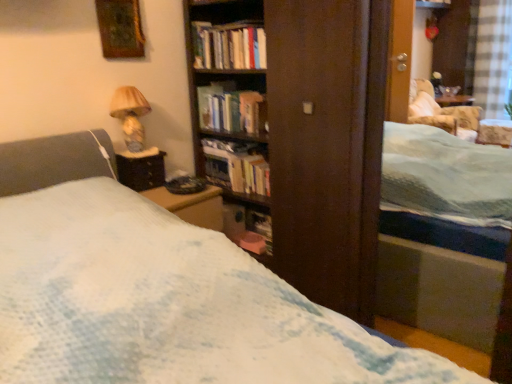
Locate an element on the screen. Image resolution: width=512 pixels, height=384 pixels. hardcover book at center, which is the first book from bottom to top is located at coordinates (236, 166).

Find the location of a particular element. This screenshot has height=384, width=512. matte beige lampshade at upper left is located at coordinates (130, 115).

Describe the element at coordinates (231, 109) in the screenshot. I see `hardcover books at center, which appears as the 2th book when viewed from the top` at that location.

What is the approximate height of hardcover books at center, the second book positioned from the bottom?

It is 10.26 inches.

In order to face wooden table at left, should I rotate leftwards or rightwards?

To face it directly, rotate left by 15.223 degrees.

Where is `hardcover book at center, which is the first book from bottom to top`? The image size is (512, 384). hardcover book at center, which is the first book from bottom to top is located at coordinates (236, 166).

How many degrees apart are the facing directions of hardcover books at center, which ranks as the third book in bottom-to-top order, and matte beige lampshade at upper left?

They differ by 89.8 degrees in their facing directions.

Locate an element on the screen. Image resolution: width=512 pixels, height=384 pixels. table lamp beneath the hardcover books at center, which ranks as the third book in bottom-to-top order (from a real-world perspective) is located at coordinates (130, 115).

Looking at this image, is hardcover books at center, which is counted as the first book, starting from the top, completely or partially outside of matte beige lampshade at upper left?

Yes.

Between hardcover books at center, which is counted as the first book, starting from the top, and matte beige lampshade at upper left, which one has larger size?

matte beige lampshade at upper left is bigger.

From a real-world perspective, relative to hardcover book at center, which ranks as the third book in top-to-bottom order, is wooden table at left vertically above or below?

In terms of real-world spatial position, wooden table at left is above hardcover book at center, which ranks as the third book in top-to-bottom order.

Based on the photo, is wooden table at left to the right of hardcover book at center, which is the first book from bottom to top, from the viewer's perspective?

In fact, wooden table at left is to the left of hardcover book at center, which is the first book from bottom to top.

There is a hardcover book at center, which is the first book from bottom to top. Where is `table above it (from a real-world perspective)`? table above it (from a real-world perspective) is located at coordinates (141, 171).

From the picture: Is wooden table at left aimed at hardcover book at center, which ranks as the third book in top-to-bottom order?

No, wooden table at left is not aimed at hardcover book at center, which ranks as the third book in top-to-bottom order.

Is the surface of gold textured frame at upper left in direct contact with hardcover books at center, which ranks as the third book in bottom-to-top order?

No, gold textured frame at upper left is not touching hardcover books at center, which ranks as the third book in bottom-to-top order.

Starting from the gold textured frame at upper left, which book is the 3rd one to the right? Please provide its 2D coordinates.

[(229, 46)]

Based on the photo, is hardcover books at center, which ranks as the third book in bottom-to-top order, at the back of gold textured frame at upper left?

That's not correct — gold textured frame at upper left is not looking away from hardcover books at center, which ranks as the third book in bottom-to-top order.

From their relative heights in the image, would you say gold textured frame at upper left is taller or shorter than hardcover books at center, which ranks as the third book in bottom-to-top order?

Considering their sizes, gold textured frame at upper left has more height than hardcover books at center, which ranks as the third book in bottom-to-top order.

Is matte beige lampshade at upper left aimed at hardcover book at center, which is the first book from bottom to top?

Answer: No, matte beige lampshade at upper left is not aimed at hardcover book at center, which is the first book from bottom to top.

Is hardcover book at center, which ranks as the third book in top-to-bottom order, inside matte beige lampshade at upper left?

No, hardcover book at center, which ranks as the third book in top-to-bottom order, is not inside matte beige lampshade at upper left.

Consider the image. Between matte beige lampshade at upper left and hardcover book at center, which is the first book from bottom to top, which one is positioned in front?

matte beige lampshade at upper left is more forward.

Based on the photo, which object is positioned more to the left, matte beige lampshade at upper left or hardcover book at center, which is the first book from bottom to top?

From the viewer's perspective, matte beige lampshade at upper left appears more on the left side.

Considering the positions of objects matte beige lampshade at upper left and gold textured frame at upper left in the image provided, who is behind, matte beige lampshade at upper left or gold textured frame at upper left?

gold textured frame at upper left.

Looking at this image, would you say matte beige lampshade at upper left is to the left or to the right of gold textured frame at upper left in the picture?

matte beige lampshade at upper left is positioned on gold textured frame at upper left's right side.

Image resolution: width=512 pixels, height=384 pixels. I want to click on picture frame above the matte beige lampshade at upper left (from a real-world perspective), so click(x=120, y=28).

Is point (106, 20) more distant than point (141, 176)?

No.

Looking at the image, does gold textured frame at upper left seem bigger or smaller compared to wooden table at left?

Considering their sizes, gold textured frame at upper left takes up less space than wooden table at left.

Would you consider gold textured frame at upper left to be distant from wooden table at left?

gold textured frame at upper left is near wooden table at left, not far away.

Is gold textured frame at upper left facing away from wooden table at left?

gold textured frame at upper left is not turned away from wooden table at left.

Does hardcover books at center, which ranks as the third book in bottom-to-top order, have a lesser height compared to gold textured frame at upper left?

Indeed, hardcover books at center, which ranks as the third book in bottom-to-top order, has a lesser height compared to gold textured frame at upper left.

Considering the positions of point (211, 48) and point (110, 32), is point (211, 48) closer or farther from the camera than point (110, 32)?

Point (211, 48) is positioned farther from the camera compared to point (110, 32).

Is hardcover books at center, which ranks as the third book in bottom-to-top order, to the left of gold textured frame at upper left from the viewer's perspective?

In fact, hardcover books at center, which ranks as the third book in bottom-to-top order, is to the right of gold textured frame at upper left.

Can we say hardcover books at center, which ranks as the third book in bottom-to-top order, lies outside gold textured frame at upper left?

Indeed, hardcover books at center, which ranks as the third book in bottom-to-top order, is completely outside gold textured frame at upper left.

Find the location of a particular element. The image size is (512, 384). table lamp lying below the hardcover books at center, which is counted as the first book, starting from the top (from the image's perspective) is located at coordinates (130, 115).

I want to click on book below the wooden table at left (from a real-world perspective), so click(x=236, y=166).

Estimate the real-world distances between objects in this image. Which object is further from hardcover books at center, which appears as the 2th book when viewed from the top, matte beige lampshade at upper left or gold textured frame at upper left?

The object further to hardcover books at center, which appears as the 2th book when viewed from the top, is gold textured frame at upper left.

Which object lies nearer to the anchor point hardcover books at center, which is counted as the first book, starting from the top, hardcover book at center, which is the first book from bottom to top, or hardcover books at center, which appears as the 2th book when viewed from the top?

The object closer to hardcover books at center, which is counted as the first book, starting from the top, is hardcover books at center, which appears as the 2th book when viewed from the top.

Considering their positions, is hardcover books at center, which is counted as the first book, starting from the top, positioned further to hardcover books at center, which appears as the 2th book when viewed from the top, than wooden table at left?

The object further to hardcover books at center, which appears as the 2th book when viewed from the top, is wooden table at left.

Considering their positions, is gold textured frame at upper left positioned further to hardcover book at center, which is the first book from bottom to top, than wooden table at left?

The object further to hardcover book at center, which is the first book from bottom to top, is gold textured frame at upper left.

Which object lies nearer to the anchor point hardcover books at center, the second book positioned from the bottom, gold textured frame at upper left or hardcover book at center, which is the first book from bottom to top?

hardcover book at center, which is the first book from bottom to top, lies closer to hardcover books at center, the second book positioned from the bottom, than the other object.

Estimate the real-world distances between objects in this image. Which object is further from hardcover book at center, which ranks as the third book in top-to-bottom order, hardcover books at center, the second book positioned from the bottom, or hardcover books at center, which is counted as the first book, starting from the top?

Among the two, hardcover books at center, which is counted as the first book, starting from the top, is located further to hardcover book at center, which ranks as the third book in top-to-bottom order.

Based on their spatial positions, is hardcover book at center, which ranks as the third book in top-to-bottom order, or wooden table at left closer to hardcover books at center, which is counted as the first book, starting from the top?

hardcover book at center, which ranks as the third book in top-to-bottom order.

Considering their positions, is gold textured frame at upper left positioned further to hardcover books at center, which ranks as the third book in bottom-to-top order, than wooden table at left?

wooden table at left.

Locate an element on the screen. This screenshot has width=512, height=384. table between matte beige lampshade at upper left and hardcover book at center, which is the first book from bottom to top is located at coordinates (141, 171).

Identify the location of table lamp between hardcover books at center, which ranks as the third book in bottom-to-top order, and wooden table at left in the up-down direction. (130, 115).

Where is `book between wooden table at left and hardcover books at center, the second book positioned from the bottom, in the horizontal direction`? book between wooden table at left and hardcover books at center, the second book positioned from the bottom, in the horizontal direction is located at coordinates (236, 166).

At what (x,y) coordinates should I click in order to perform the action: click on table lamp between gold textured frame at upper left and hardcover books at center, which ranks as the third book in bottom-to-top order, in the horizontal direction. Please return your answer as a coordinate pair (x, y). The image size is (512, 384). Looking at the image, I should click on (130, 115).